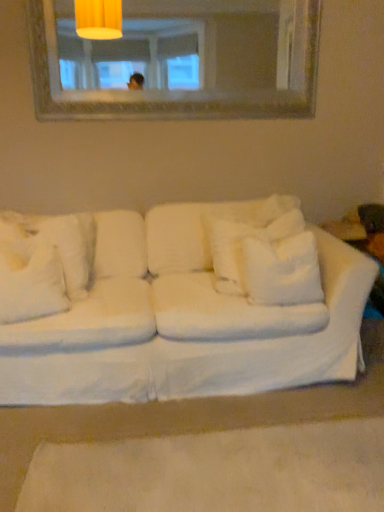
You are a GUI agent. You are given a task and a screenshot of the screen. Output one action in this format:
    pyautogui.click(x=<x>, y=<y>)
    Task: Click on the white fluffy pillow at left, the 4th pillow from the right
    
    Given the screenshot: What is the action you would take?
    pyautogui.click(x=65, y=244)

Image resolution: width=384 pixels, height=512 pixels. What do you see at coordinates (30, 279) in the screenshot?
I see `white fluffy pillow at left, the 2th pillow viewed from the left` at bounding box center [30, 279].

This screenshot has width=384, height=512. Describe the element at coordinates (181, 55) in the screenshot. I see `wooden frame mirror at upper center` at that location.

This screenshot has width=384, height=512. In order to click on white fluffy pillow at center, the 2th pillow in the right-to-left sequence in this screenshot , I will do (x=248, y=236).

What are the coordinates of `white fluffy pillow at left, the 4th pillow from the right` in the screenshot? It's located at (65, 244).

Considering the sizes of white fabric couch at center and white fluffy pillow at center, the 2th pillow in the right-to-left sequence, in the image, is white fabric couch at center bigger or smaller than white fluffy pillow at center, the 2th pillow in the right-to-left sequence,?

Considering their sizes, white fabric couch at center takes up more space than white fluffy pillow at center, the 2th pillow in the right-to-left sequence.

Does point (332, 320) come farther from viewer compared to point (227, 275)?

That is False.

How far apart are white fabric couch at center and white fluffy pillow at center, the 2th pillow in the right-to-left sequence?

white fabric couch at center and white fluffy pillow at center, the 2th pillow in the right-to-left sequence, are 9.62 inches apart from each other.

Is wooden frame mirror at upper center positioned far away from white fluffy pillow at center, the third pillow from the left?

wooden frame mirror at upper center is positioned a significant distance from white fluffy pillow at center, the third pillow from the left.

Considering the positions of point (210, 33) and point (258, 219), is point (210, 33) closer or farther from the camera than point (258, 219)?

Point (210, 33) appears to be farther away from the viewer than point (258, 219).

Is wooden frame mirror at upper center behind white fluffy pillow at center, the 2th pillow in the right-to-left sequence?

Yes, it is behind white fluffy pillow at center, the 2th pillow in the right-to-left sequence.

From a real-world perspective, is wooden frame mirror at upper center positioned over white fluffy pillow at center, the third pillow from the left, based on gravity?

Yes, from a real-world perspective, wooden frame mirror at upper center is above white fluffy pillow at center, the third pillow from the left.

From the image's perspective, would you say white fluffy pillow at left, which ranks as the 3th pillow in right-to-left order, is positioned over white fluffy pillow at center, the 2th pillow in the right-to-left sequence?

No, from the image's perspective, white fluffy pillow at left, which ranks as the 3th pillow in right-to-left order, is not on top of white fluffy pillow at center, the 2th pillow in the right-to-left sequence.

Looking at their sizes, would you say white fluffy pillow at left, which ranks as the 3th pillow in right-to-left order, is wider or thinner than white fluffy pillow at center, the third pillow from the left?

Considering their sizes, white fluffy pillow at left, which ranks as the 3th pillow in right-to-left order, looks broader than white fluffy pillow at center, the third pillow from the left.

Considering the sizes of objects white fluffy pillow at left, the 2th pillow viewed from the left, and white fluffy pillow at center, the 2th pillow in the right-to-left sequence, in the image provided, who is smaller, white fluffy pillow at left, the 2th pillow viewed from the left, or white fluffy pillow at center, the 2th pillow in the right-to-left sequence,?

Smaller between the two is white fluffy pillow at left, the 2th pillow viewed from the left.

Is white soft pillow at center, the fourth pillow in the left-to-right sequence, turned away from wooden frame mirror at upper center?

That's not correct — white soft pillow at center, the fourth pillow in the left-to-right sequence, is not looking away from wooden frame mirror at upper center.

Is white soft pillow at center, arranged as the 1th pillow when viewed from the right, closer to the viewer compared to wooden frame mirror at upper center?

Yes, it is.

Which is behind, white fabric couch at center or wooden frame mirror at upper center?

wooden frame mirror at upper center.

Is white fabric couch at center placed right next to wooden frame mirror at upper center?

No.

Is point (157, 268) less distant than point (225, 64)?

That is True.

Would you say white fabric couch at center contains wooden frame mirror at upper center?

Definitely not — wooden frame mirror at upper center is not inside white fabric couch at center.

Is white fluffy pillow at left, arranged as the first pillow when viewed from the left, closer to camera compared to white fabric couch at center?

No, white fluffy pillow at left, arranged as the first pillow when viewed from the left, is further to the viewer.

Between white fluffy pillow at left, the 4th pillow from the right, and white fabric couch at center, which one appears on the left side from the viewer's perspective?

From the viewer's perspective, white fluffy pillow at left, the 4th pillow from the right, appears more on the left side.

Based on the photo, from a real-world perspective, relative to white fabric couch at center, is white fluffy pillow at left, arranged as the first pillow when viewed from the left, vertically above or below?

white fluffy pillow at left, arranged as the first pillow when viewed from the left, is above white fabric couch at center.

Can you confirm if white fluffy pillow at left, the 4th pillow from the right, is wider than white fabric couch at center?

No.

From the image's perspective, would you say white fluffy pillow at left, the 4th pillow from the right, is positioned over white soft pillow at center, arranged as the 1th pillow when viewed from the right?

Yes, from the image's perspective, white fluffy pillow at left, the 4th pillow from the right, is above white soft pillow at center, arranged as the 1th pillow when viewed from the right.

Which object is closer to the camera taking this photo, white fluffy pillow at left, arranged as the first pillow when viewed from the left, or white soft pillow at center, the fourth pillow in the left-to-right sequence?

white soft pillow at center, the fourth pillow in the left-to-right sequence, is in front.

Is white fluffy pillow at left, arranged as the first pillow when viewed from the left, not within white soft pillow at center, the fourth pillow in the left-to-right sequence?

Yes.

I want to click on studio couch on the left side of white fluffy pillow at center, the third pillow from the left, so click(x=195, y=313).

Identify the location of the 1st pillow below the wooden frame mirror at upper center (from the image's perspective). The width and height of the screenshot is (384, 512). (248, 236).

Estimate the real-world distances between objects in this image. Which object is closer to white fluffy pillow at left, arranged as the first pillow when viewed from the left, white soft pillow at center, arranged as the 1th pillow when viewed from the right, or white fabric couch at center?

Based on the image, white fabric couch at center appears to be nearer to white fluffy pillow at left, arranged as the first pillow when viewed from the left.

Looking at the image, which one is located closer to white fluffy pillow at center, the third pillow from the left, white fluffy pillow at left, the 2th pillow viewed from the left, or white soft pillow at center, the fourth pillow in the left-to-right sequence?

white soft pillow at center, the fourth pillow in the left-to-right sequence, is positioned closer to the anchor white fluffy pillow at center, the third pillow from the left.

Based on their spatial positions, is wooden frame mirror at upper center or white fabric couch at center further from white fluffy pillow at center, the third pillow from the left?

wooden frame mirror at upper center is positioned further to the anchor white fluffy pillow at center, the third pillow from the left.

Based on their spatial positions, is wooden frame mirror at upper center or white fluffy pillow at left, the 4th pillow from the right, further from white fluffy pillow at center, the 2th pillow in the right-to-left sequence?

wooden frame mirror at upper center is further to white fluffy pillow at center, the 2th pillow in the right-to-left sequence.

When comparing their distances from white fluffy pillow at left, the 2th pillow viewed from the left, does wooden frame mirror at upper center or white fabric couch at center seem further?

wooden frame mirror at upper center is positioned further to the anchor white fluffy pillow at left, the 2th pillow viewed from the left.

From the image, which object appears to be nearer to white soft pillow at center, arranged as the 1th pillow when viewed from the right, white fabric couch at center or white fluffy pillow at left, the 4th pillow from the right?

white fabric couch at center.

From the image, which object appears to be farther from white fabric couch at center, white fluffy pillow at center, the 2th pillow in the right-to-left sequence, or white fluffy pillow at left, the 4th pillow from the right?

Among the two, white fluffy pillow at left, the 4th pillow from the right, is located further to white fabric couch at center.

Considering their positions, is white fluffy pillow at left, which ranks as the 3th pillow in right-to-left order, positioned further to white fluffy pillow at left, arranged as the first pillow when viewed from the left, than wooden frame mirror at upper center?

The object further to white fluffy pillow at left, arranged as the first pillow when viewed from the left, is wooden frame mirror at upper center.

Identify the location of studio couch located between white fluffy pillow at left, the 2th pillow viewed from the left, and white fluffy pillow at center, the 2th pillow in the right-to-left sequence, in the left-right direction. (195, 313).

Identify the location of pillow located between white fabric couch at center and white soft pillow at center, the fourth pillow in the left-to-right sequence, in the left-right direction. (248, 236).

Where is `studio couch between white fluffy pillow at left, the 4th pillow from the right, and white soft pillow at center, the fourth pillow in the left-to-right sequence`? This screenshot has width=384, height=512. studio couch between white fluffy pillow at left, the 4th pillow from the right, and white soft pillow at center, the fourth pillow in the left-to-right sequence is located at coordinates (195, 313).

Identify the location of pillow located between white fluffy pillow at left, which ranks as the 3th pillow in right-to-left order, and white soft pillow at center, the fourth pillow in the left-to-right sequence, in the left-right direction. The image size is (384, 512). (248, 236).